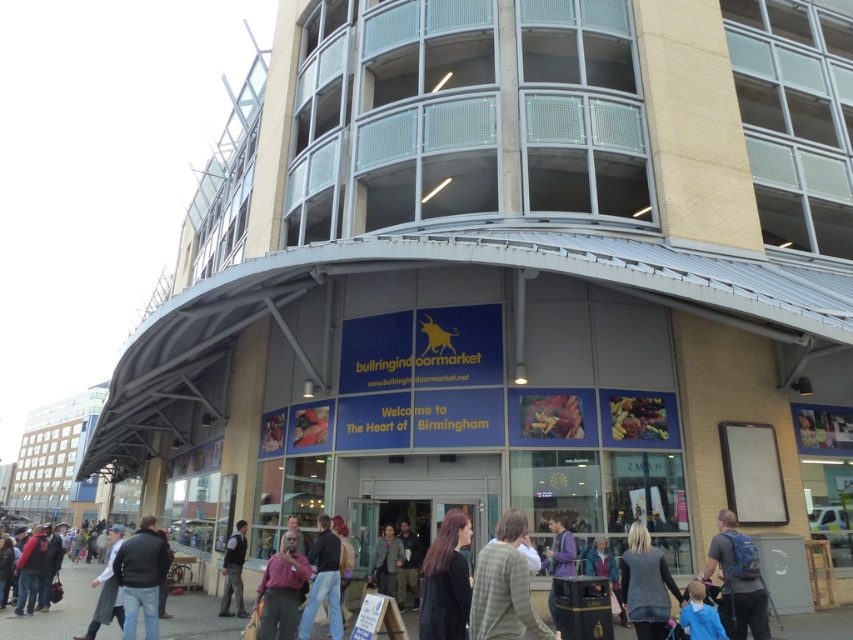
You are a customer entering the building and see the khaki fabric jacket at center and the blue denim jacket at lower center. Which jacket is closer to the entrance?

The blue denim jacket at lower center is closer to the entrance because the khaki fabric jacket at center is positioned under it, indicating it is behind in the spatial arrangement.